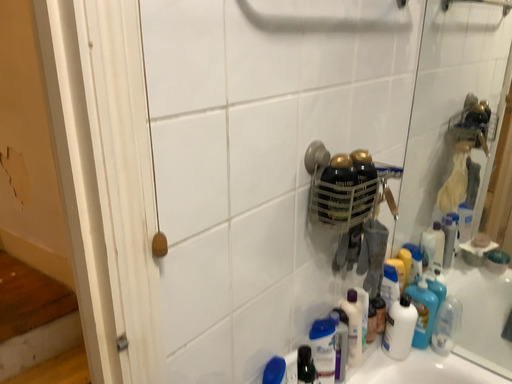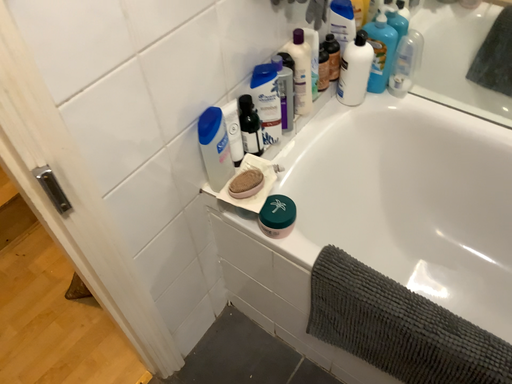
Question: How did the camera likely rotate when shooting the video?

Choices:
 (A) rotated downward
 (B) rotated upward

Answer: (A)